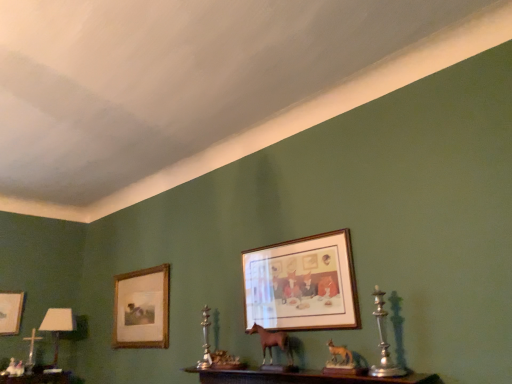
Question: From the image's perspective, is white glossy table lamp at lower left positioned above or below matte gold picture frame at left, positioned as the third picture frame in front-to-back order?

Choices:
 (A) above
 (B) below

Answer: (B)

Question: Considering their positions, is white glossy table lamp at lower left located in front of or behind matte gold picture frame at left, positioned as the third picture frame in front-to-back order?

Choices:
 (A) behind
 (B) front

Answer: (A)

Question: Based on their relative distances, which object is nearer to the wooden picture frame at left, positioned as the 2th picture frame in back-to-front order?

Choices:
 (A) matte gold picture frame at left, which appears as the first picture frame when viewed from the back
 (B) wooden frame at center, the first picture frame from the front
 (C) brown matte horse at center
 (D) silver metallic candle holder at right, which is the first candle holder from top to bottom
 (E) white glossy table lamp at lower left

Answer: (E)

Question: Which of these objects is positioned farthest from the white glossy table lamp at lower left?

Choices:
 (A) matte gold picture frame at left, positioned as the third picture frame in front-to-back order
 (B) wooden picture frame at left, which ranks as the second picture frame in left-to-right order
 (C) silver metallic candle holder at center, marked as the second candle holder in a right-to-left arrangement
 (D) brown matte horse at center
 (E) wooden frame at center, the first picture frame from the front

Answer: (E)